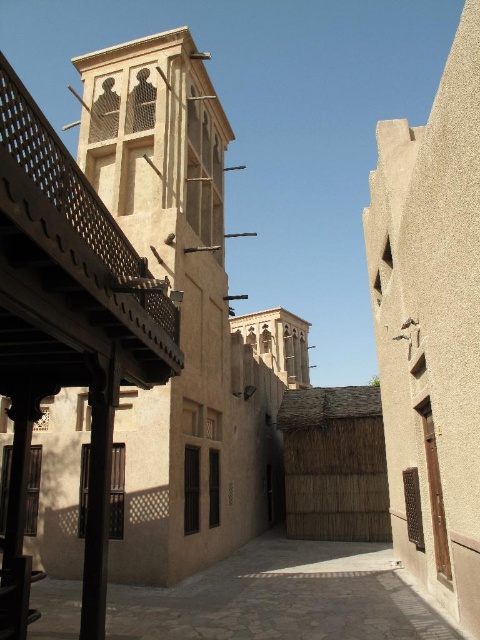
Is beige textured tower at center shorter than brown textured courtyard at center?

No.

Is beige textured tower at center positioned behind brown textured courtyard at center?

That is True.

Which is behind, point (204, 132) or point (334, 611)?

Point (204, 132)

Find the location of a particular element. The height and width of the screenshot is (640, 480). beige textured tower at center is located at coordinates (180, 301).